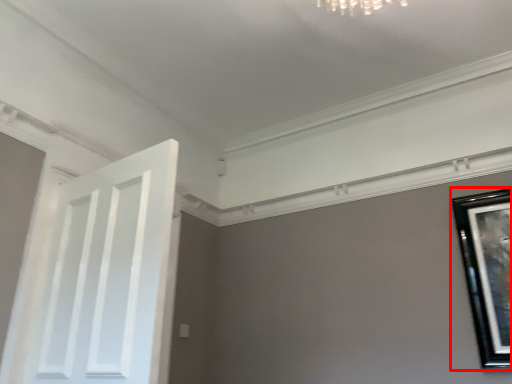
Question: Observing the image, what is the correct spatial positioning of picture frame (annotated by the red box) in reference to door?

Choices:
 (A) left
 (B) right

Answer: (B)